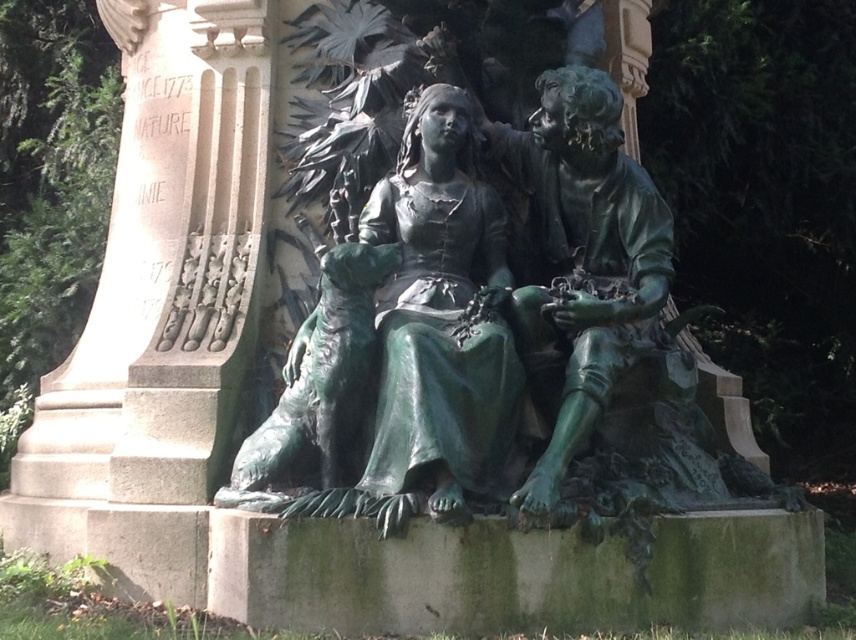
Which is below, green patina statue at center or green patina statue at right?

green patina statue at center is lower down.

Who is higher up, green patina statue at center or green patina statue at right?

green patina statue at right is above.

Which is behind, point (473, 259) or point (527, 154)?

Positioned behind is point (527, 154).

Image resolution: width=856 pixels, height=640 pixels. I want to click on green patina statue at center, so click(x=438, y=323).